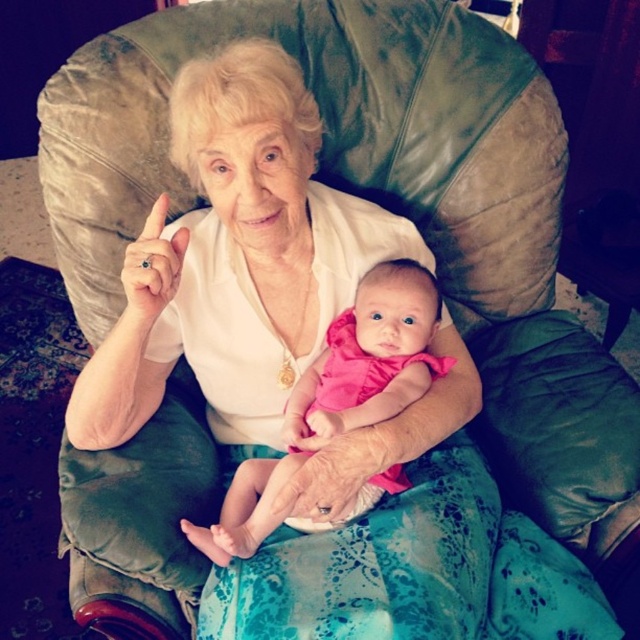
Between point (387, 481) and point (138, 253), which one is positioned behind?

Positioned behind is point (387, 481).

Does pink fabric baby at center lie in front of gold ring at upper center?

No, it is behind gold ring at upper center.

Does point (428, 301) come farther from viewer compared to point (154, 204)?

Yes, point (428, 301) is farther from viewer.

Locate an element on the screen. pink fabric baby at center is located at coordinates (371, 355).